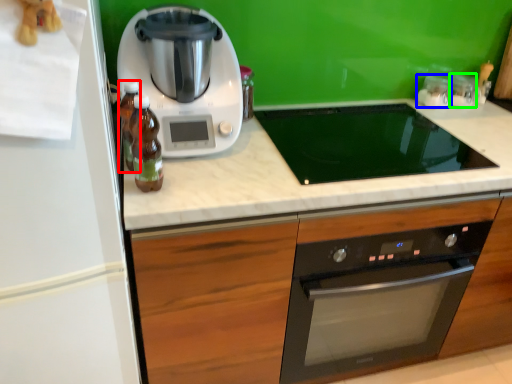
Question: Which object is the farthest from bottle (highlighted by a red box)? Choose among these: appliance (highlighted by a blue box) or appliance (highlighted by a green box).

Choices:
 (A) appliance
 (B) appliance

Answer: (B)